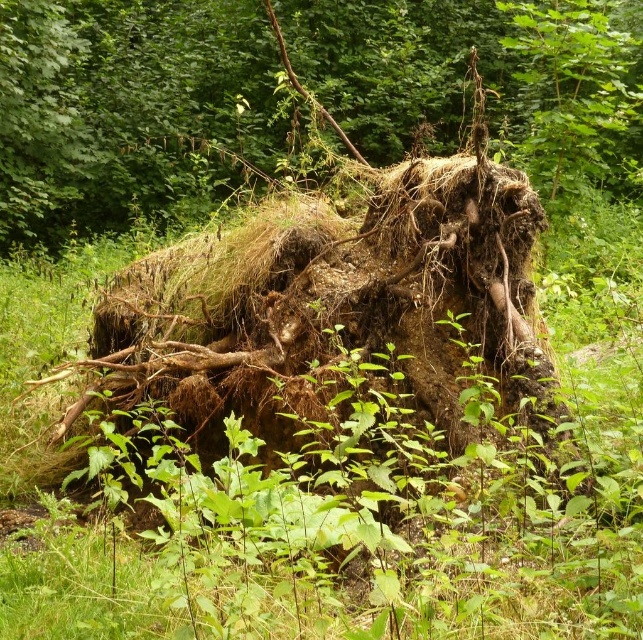
Question: Is brown/rooty tree stump at center above green leafy grass at center?

Choices:
 (A) yes
 (B) no

Answer: (A)

Question: Is brown/rooty tree stump at center behind green leafy grass at center?

Choices:
 (A) yes
 (B) no

Answer: (A)

Question: Which point is closer to the camera?

Choices:
 (A) brown/rooty tree stump at center
 (B) green leafy grass at center

Answer: (B)

Question: Which of the following is the farthest from the observer?

Choices:
 (A) green leafy grass at center
 (B) brown/rooty tree stump at center

Answer: (B)

Question: Which point is farther from the camera taking this photo?

Choices:
 (A) click(341, 116)
 (B) click(12, 410)

Answer: (A)

Question: Does brown/rooty tree stump at center come in front of green leafy grass at center?

Choices:
 (A) no
 (B) yes

Answer: (A)